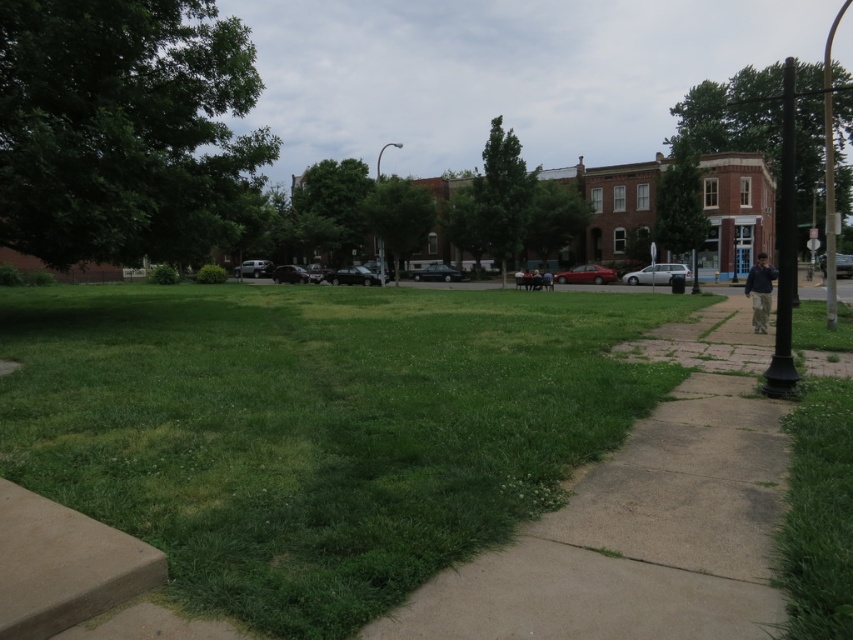
Between black metal pole at right and metallic pole at center, which one is positioned lower?

metallic pole at center

Which is in front, point (782, 280) or point (376, 154)?

Point (782, 280) is more forward.

Does point (776, 241) come in front of point (376, 240)?

Yes.

Locate an element on the screen. This screenshot has height=640, width=853. black metal pole at right is located at coordinates (784, 250).

The height and width of the screenshot is (640, 853). What do you see at coordinates (830, 172) in the screenshot?
I see `metallic pole at right` at bounding box center [830, 172].

Is point (825, 160) farther from viewer compared to point (766, 272)?

Yes, it is.

Between point (833, 292) and point (764, 291), which one is positioned in front?

Point (764, 291) is more forward.

Find the location of a particular element. Image resolution: width=853 pixels, height=640 pixels. metallic pole at right is located at coordinates (830, 172).

Who is higher up, green grassy area at center or dark blue jacket at right?

dark blue jacket at right

Can you confirm if green grassy area at center is taller than dark blue jacket at right?

Incorrect, green grassy area at center's height is not larger of dark blue jacket at right's.

Which is in front, point (500, 358) or point (750, 269)?

Point (500, 358) is in front.

Where is `green grassy area at center`? Image resolution: width=853 pixels, height=640 pixels. green grassy area at center is located at coordinates (316, 428).